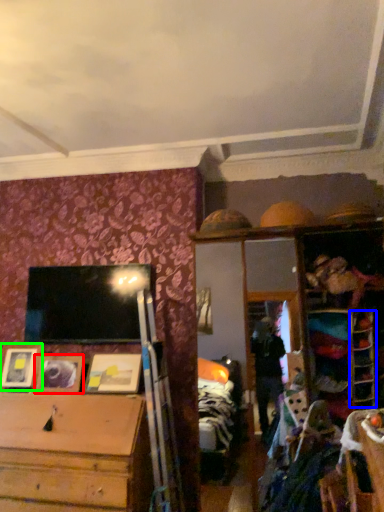
Question: Which object is positioned farthest from picture frame (highlighted by a red box)? Select from shelf (highlighted by a blue box) and picture frame (highlighted by a green box).

Choices:
 (A) shelf
 (B) picture frame

Answer: (A)